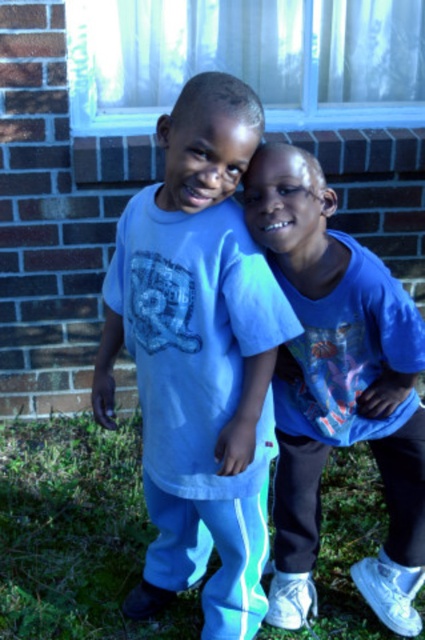
Question: Which of the following is the closest to the observer?

Choices:
 (A) (42, 604)
 (B) (285, 225)
 (C) (108, 422)

Answer: (B)

Question: Among these objects, which one is farthest from the camera?

Choices:
 (A) green grass at lower center
 (B) matte blue t-shirt at center
 (C) light blue cotton shirt at center

Answer: (A)

Question: Among these points, which one is nearest to the camera?

Choices:
 (A) (294, 314)
 (B) (5, 576)

Answer: (A)

Question: Does light blue cotton shirt at center have a greater width compared to green grass at lower center?

Choices:
 (A) yes
 (B) no

Answer: (B)

Question: Is light blue cotton shirt at center wider than matte blue t-shirt at center?

Choices:
 (A) no
 (B) yes

Answer: (B)

Question: Is light blue cotton shirt at center above green grass at lower center?

Choices:
 (A) no
 (B) yes

Answer: (B)